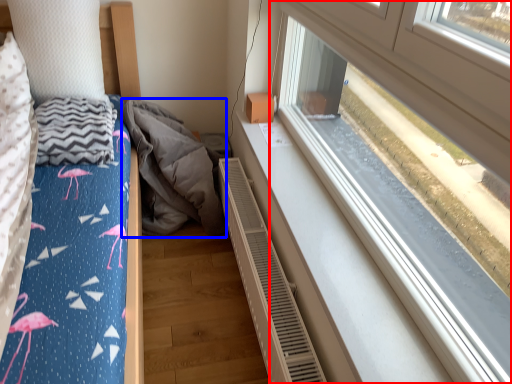
Question: Among these objects, which one is farthest to the camera, window (highlighted by a red box) or material (highlighted by a blue box)?

Choices:
 (A) window
 (B) material

Answer: (B)